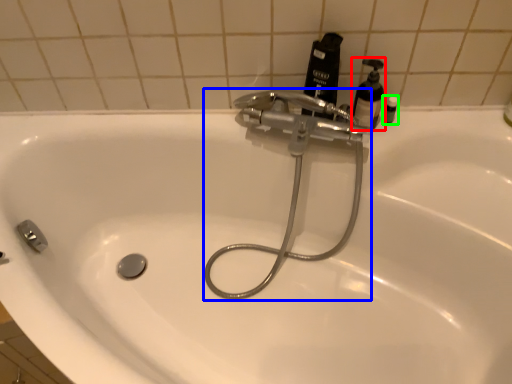
Question: Based on their relative distances, which object is farther from soap dispenser (highlighted by a red box)? Choose from plumbing fixture (highlighted by a blue box) and toiletry (highlighted by a green box).

Choices:
 (A) plumbing fixture
 (B) toiletry

Answer: (A)